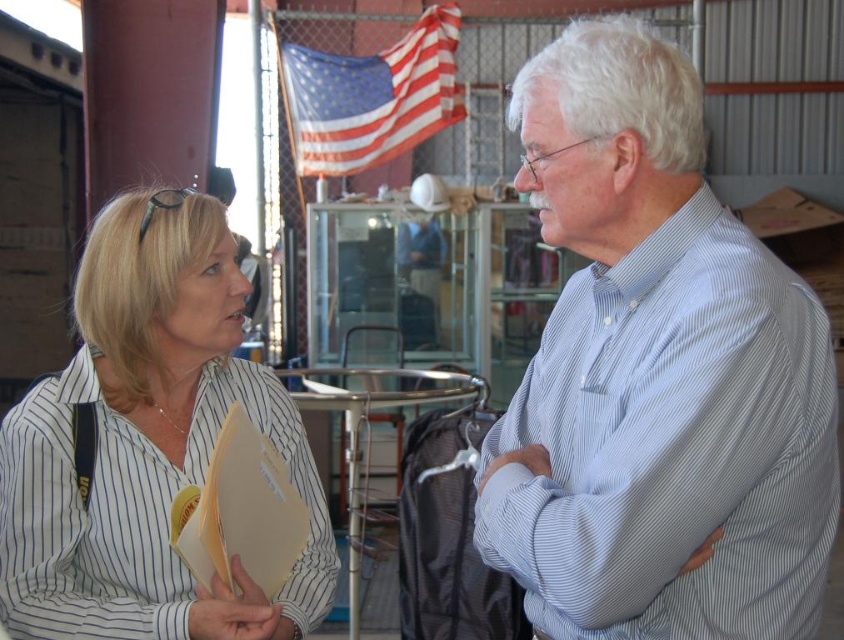
Question: Can you confirm if light blue striped shirt at center is positioned to the right of white striped shirt at left?

Choices:
 (A) yes
 (B) no

Answer: (A)

Question: Which point is closer to the camera?

Choices:
 (A) (339, 125)
 (B) (695, 349)
 (C) (220, 404)

Answer: (B)

Question: Is light blue striped shirt at center to the right of white striped shirt at left from the viewer's perspective?

Choices:
 (A) yes
 (B) no

Answer: (A)

Question: Which point is farther to the camera?

Choices:
 (A) american flag at upper center
 (B) white striped shirt at left

Answer: (A)

Question: Which point is farther to the camera?

Choices:
 (A) light blue striped shirt at center
 (B) american flag at upper center

Answer: (B)

Question: Does light blue striped shirt at center have a larger size compared to white striped shirt at left?

Choices:
 (A) yes
 (B) no

Answer: (A)